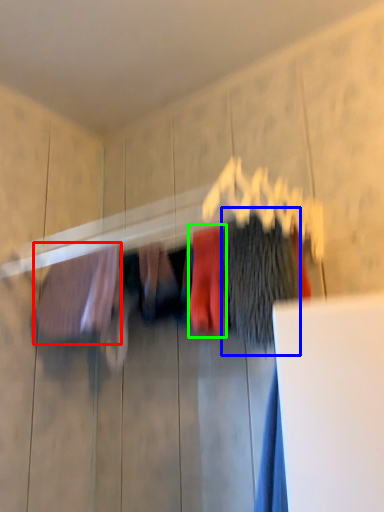
Question: Based on their relative distances, which object is nearer to clothing (highlighted by a red box)? Choose from clothing (highlighted by a blue box) and clothing (highlighted by a green box).

Choices:
 (A) clothing
 (B) clothing

Answer: (B)